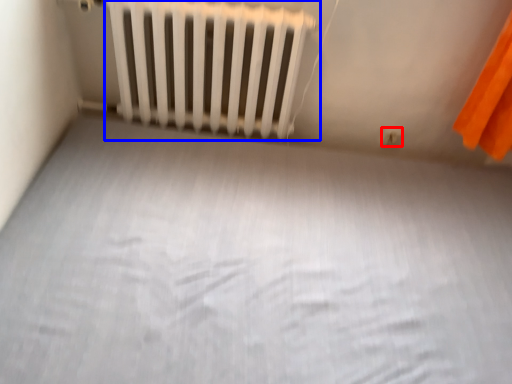
Question: Which object is closer to the camera taking this photo, electric outlet (highlighted by a red box) or radiator (highlighted by a blue box)?

Choices:
 (A) electric outlet
 (B) radiator

Answer: (B)